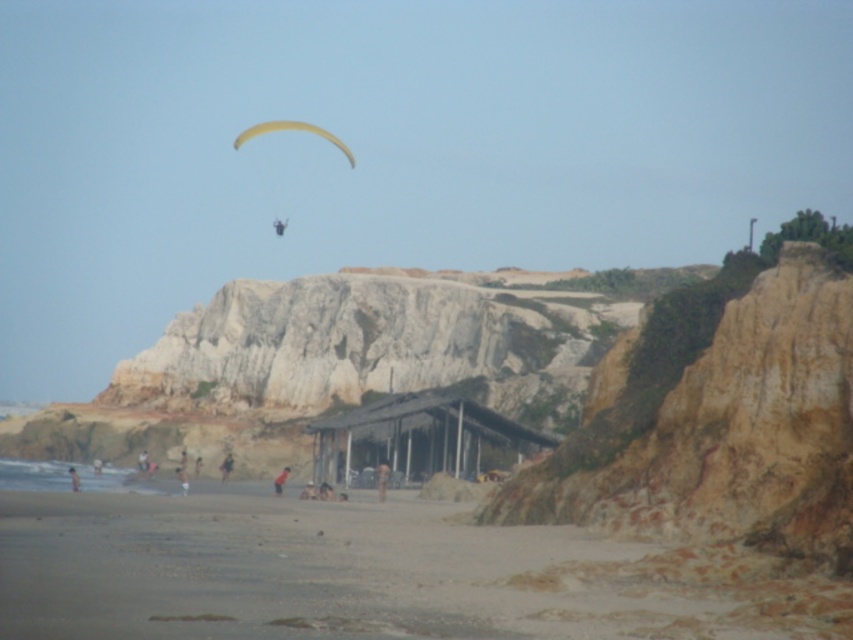
Which of these two, light brown sand at center or light brown sand at lower left, stands shorter?

light brown sand at center

Between light brown sand at center and light brown sand at lower left, which one has more height?

With more height is light brown sand at lower left.

Where is `light brown sand at center`? The image size is (853, 640). light brown sand at center is located at coordinates (280, 481).

Image resolution: width=853 pixels, height=640 pixels. I want to click on yellow fabric parachute at upper center, so click(x=292, y=129).

Can you confirm if yellow fabric parachute at upper center is smaller than light brown sand at center?

No.

Is point (276, 131) positioned behind point (279, 488)?

Yes, point (276, 131) is behind point (279, 488).

At what (x,y) coordinates should I click in order to perform the action: click on yellow fabric parachute at upper center. Please return your answer as a coordinate pair (x, y). The height and width of the screenshot is (640, 853). Looking at the image, I should click on (292, 129).

Consider the image. Does sandy beach at lower left appear over yellow fabric parachute at upper center?

No, sandy beach at lower left is not above yellow fabric parachute at upper center.

What do you see at coordinates (375, 572) in the screenshot? The image size is (853, 640). I see `sandy beach at lower left` at bounding box center [375, 572].

Between point (444, 602) and point (273, 131), which one is positioned behind?

The point (273, 131) is behind.

The height and width of the screenshot is (640, 853). In order to click on sandy beach at lower left in this screenshot , I will do `click(375, 572)`.